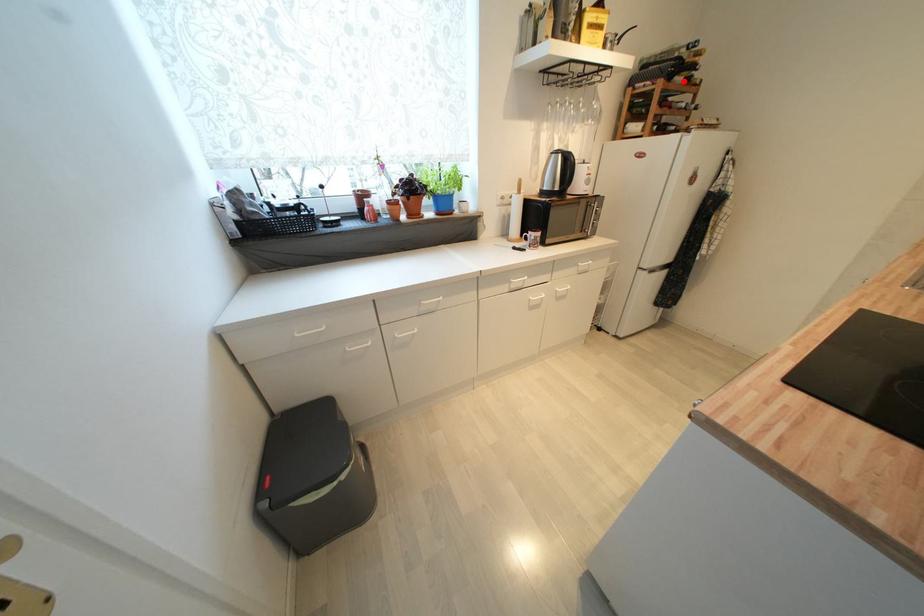
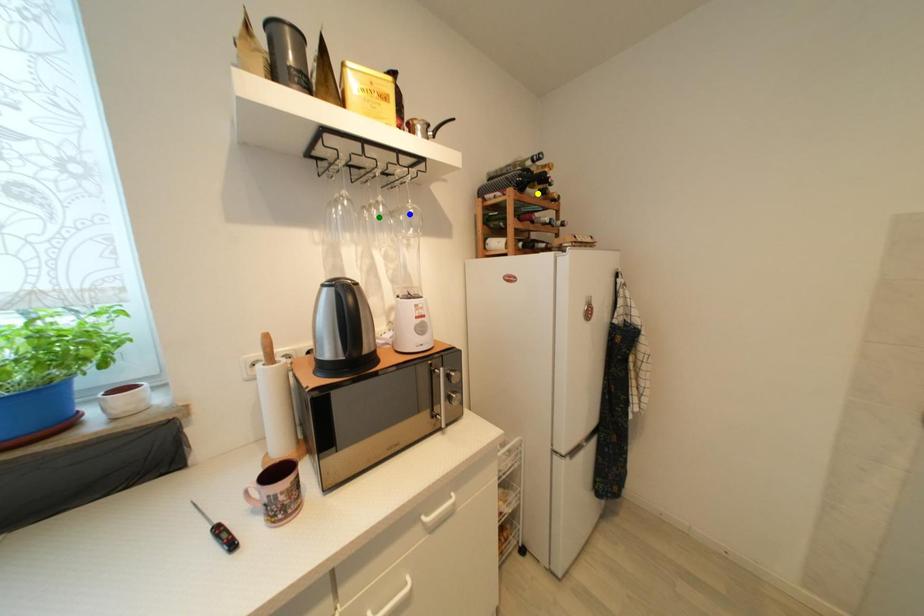
Question: I am providing you with two images of the same scene from different viewpoints. A red point is marked on the first image. You are given multiple points on the second image. In image 2, which mark is for the same physical point as the one in image 1?

Choices:
 (A) yellow point
 (B) green point
 (C) blue point

Answer: (A)